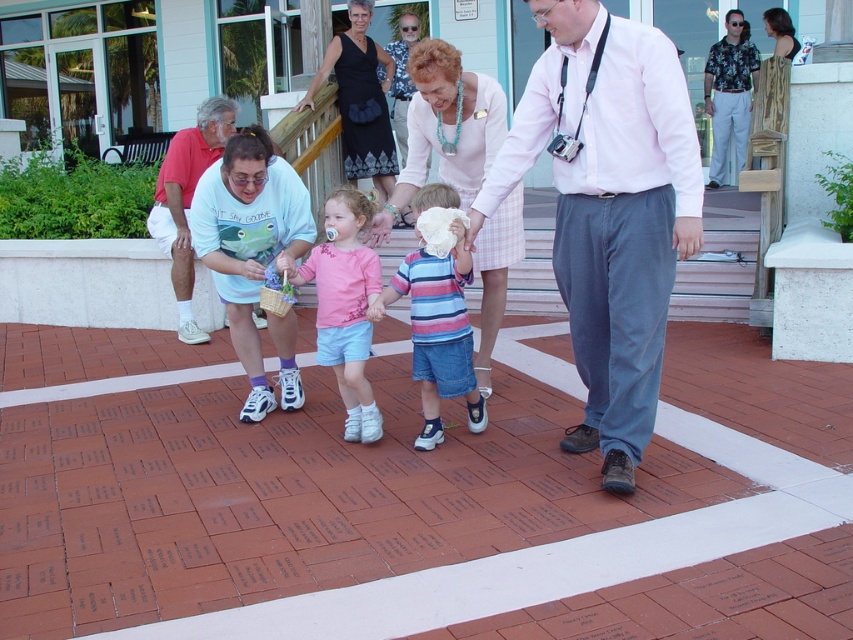
Question: Does brick pavement at center have a greater width compared to pink shirt at center?

Choices:
 (A) yes
 (B) no

Answer: (A)

Question: Can you confirm if brick pavement at center is positioned to the left of matte red shirt at left?

Choices:
 (A) no
 (B) yes

Answer: (A)

Question: Among these points, which one is farthest from the camera?

Choices:
 (A) (549, 122)
 (B) (161, 177)

Answer: (B)

Question: Is brick pavement at center smaller than striped cotton shirt at center?

Choices:
 (A) yes
 (B) no

Answer: (B)

Question: Which object is the farthest from the striped cotton shirt at center?

Choices:
 (A) pink shirt at center
 (B) pink fabric shirt at center

Answer: (A)

Question: Based on their relative distances, which object is nearer to the brick pavement at center?

Choices:
 (A) pink shirt at center
 (B) pink fabric shirt at center
 (C) matte pink dress at center
 (D) matte red shirt at left

Answer: (B)